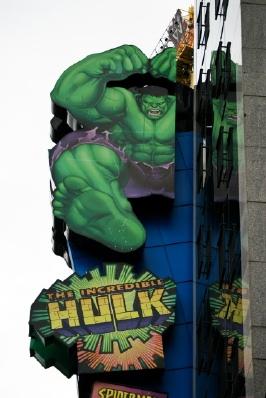
Locate an element on the screen. blue tiles is located at coordinates (175, 204), (175, 236).